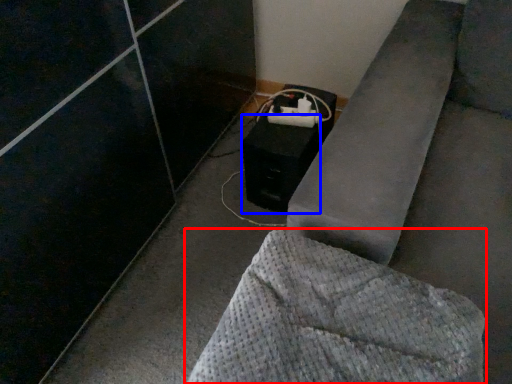
Question: Which object is further to the camera taking this photo, furniture (highlighted by a red box) or speaker (highlighted by a blue box)?

Choices:
 (A) furniture
 (B) speaker

Answer: (B)